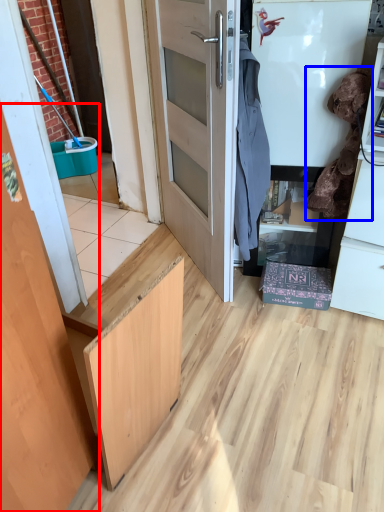
Question: Among these objects, which one is farthest to the camera, door (highlighted by a red box) or laundry (highlighted by a blue box)?

Choices:
 (A) door
 (B) laundry

Answer: (B)